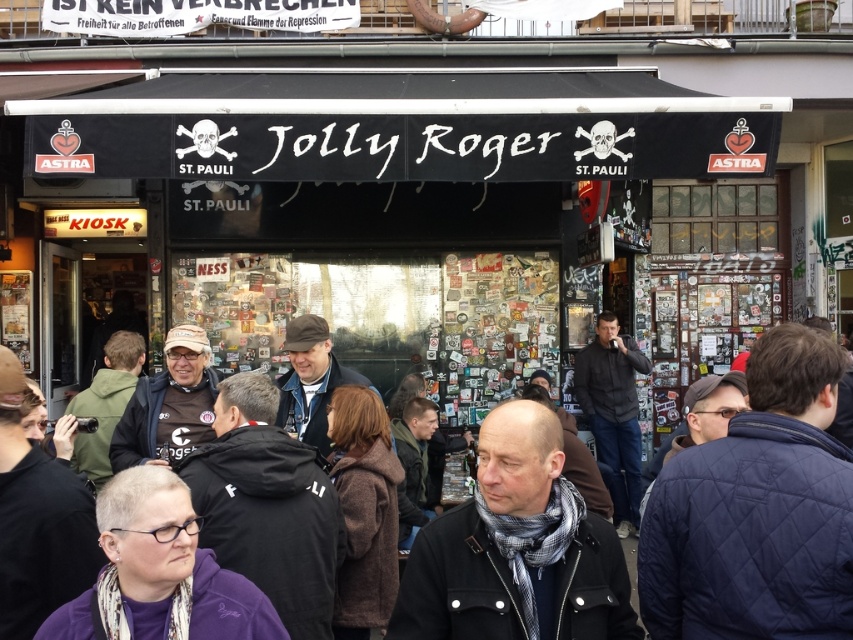
You are a delivery person standing at the entrance of the Jolly Roger shop. You need to deliver a package to someone wearing a dark brown leather jacket at center and another to someone wearing a dark gray jacket at center. If your delivery cart is 2 meters wide, can you safely navigate between them without hitting either jacket?

The distance between the dark brown leather jacket at center and the dark gray jacket at center is 6.74 meters. Since your delivery cart is 2 meters wide, there is sufficient space to navigate between them safely without hitting either jacket.

You are a customer standing in front of the Jolly Roger shop in St. Pauli. You see a dark brown leather jacket at center and a dark gray wool scarf at center. Which item is positioned higher up?

The dark brown leather jacket at center is above the dark gray wool scarf at center, so it is positioned higher up.